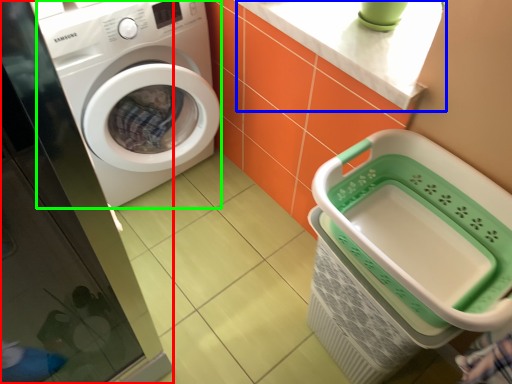
Question: Estimate the real-world distances between objects in this image. Which object is farther from screen door (highlighted by a red box), counter top (highlighted by a blue box) or washing machine (highlighted by a green box)?

Choices:
 (A) counter top
 (B) washing machine

Answer: (A)